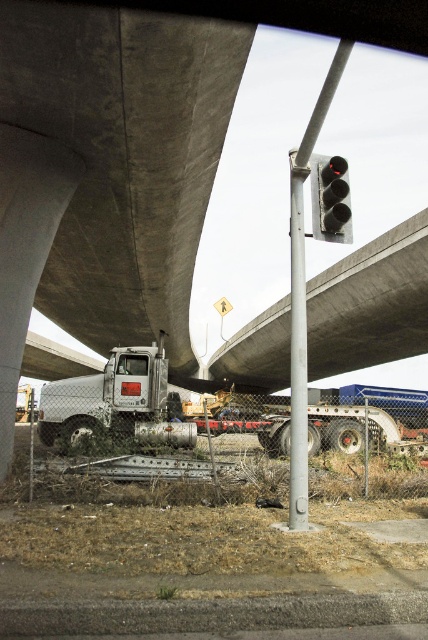
Which of these two, silver metallic trailer truck at center or silver metallic pole at center, stands taller?

silver metallic trailer truck at center is taller.

Is silver metallic trailer truck at center above silver metallic pole at center?

Actually, silver metallic trailer truck at center is below silver metallic pole at center.

At what (x,y) coordinates should I click in order to perform the action: click on silver metallic trailer truck at center. Please return your answer as a coordinate pair (x, y). Looking at the image, I should click on (107, 396).

Does concrete at upper center have a larger size compared to silver metallic truck at center?

Indeed, concrete at upper center has a larger size compared to silver metallic truck at center.

Is point (415, 333) farther from viewer compared to point (223, 420)?

Yes, point (415, 333) is behind point (223, 420).

Is point (250, 365) positioned behind point (128, 371)?

Yes, point (250, 365) is farther from viewer.

Where is `concrete at upper center`? The width and height of the screenshot is (428, 640). concrete at upper center is located at coordinates (371, 304).

Does concrete at upper center appear over silver metallic trailer truck at center?

Incorrect, concrete at upper center is not positioned above silver metallic trailer truck at center.

Is concrete at upper center shorter than silver metallic trailer truck at center?

No, concrete at upper center is not shorter than silver metallic trailer truck at center.

What do you see at coordinates (371, 304) in the screenshot?
I see `concrete at upper center` at bounding box center [371, 304].

Locate an element on the screen. concrete at upper center is located at coordinates (371, 304).